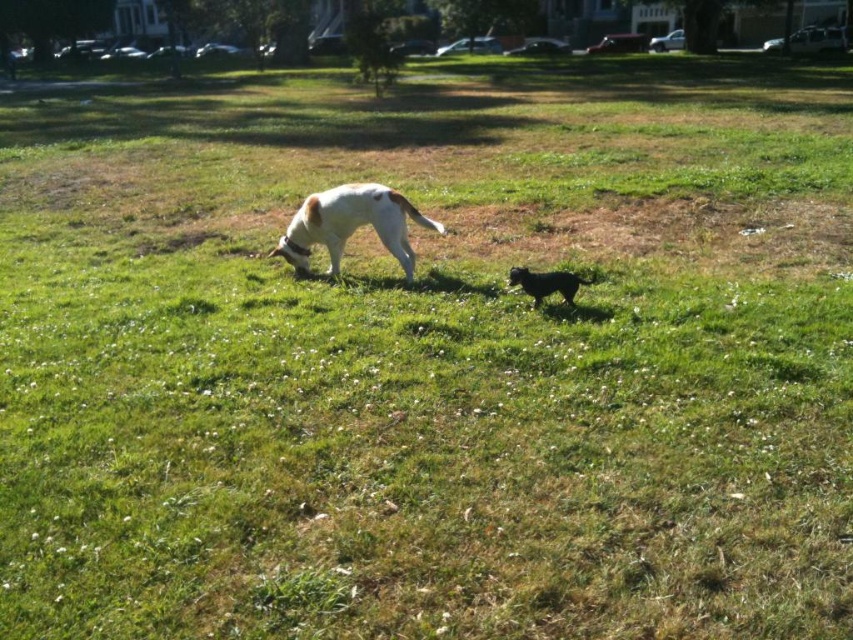
Question: Which object is closer to the camera taking this photo?

Choices:
 (A) shiny black dog at center
 (B) white matte dog at center

Answer: (A)

Question: Is white matte dog at center below shiny black dog at center?

Choices:
 (A) no
 (B) yes

Answer: (A)

Question: Does white matte dog at center come in front of shiny black dog at center?

Choices:
 (A) yes
 (B) no

Answer: (B)

Question: Is white matte dog at center above shiny black dog at center?

Choices:
 (A) yes
 (B) no

Answer: (A)